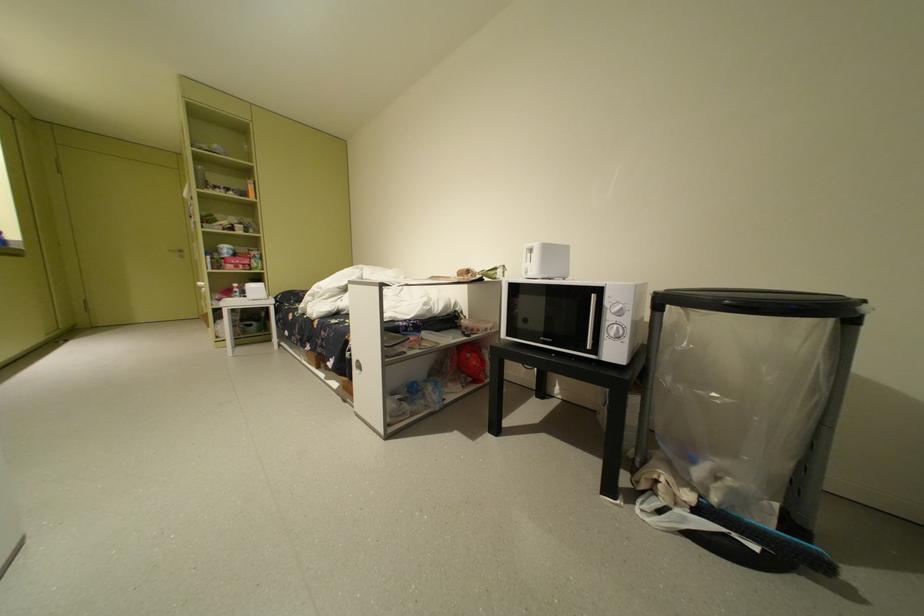
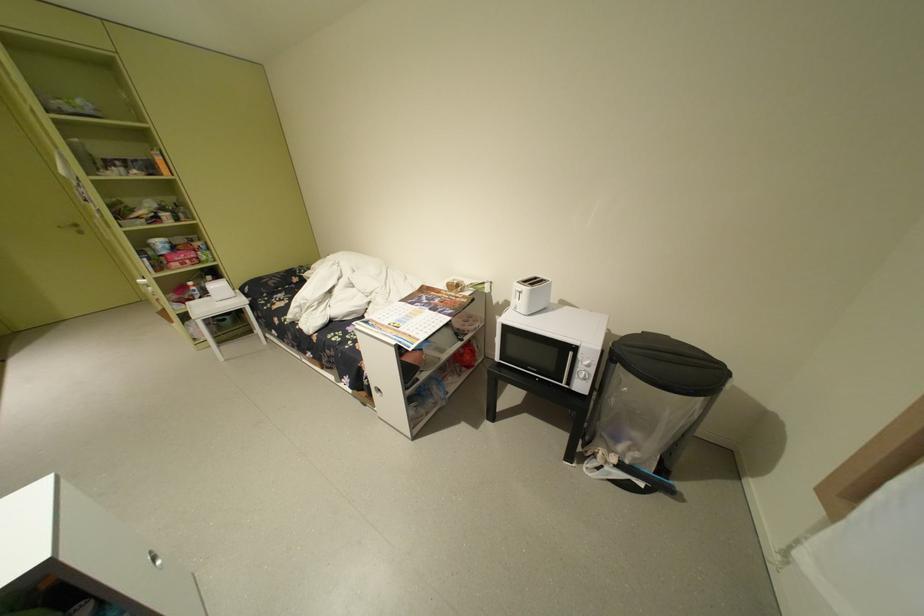
Find the pixel in the second image that matches pixel 617 334 in the first image.

(588, 377)